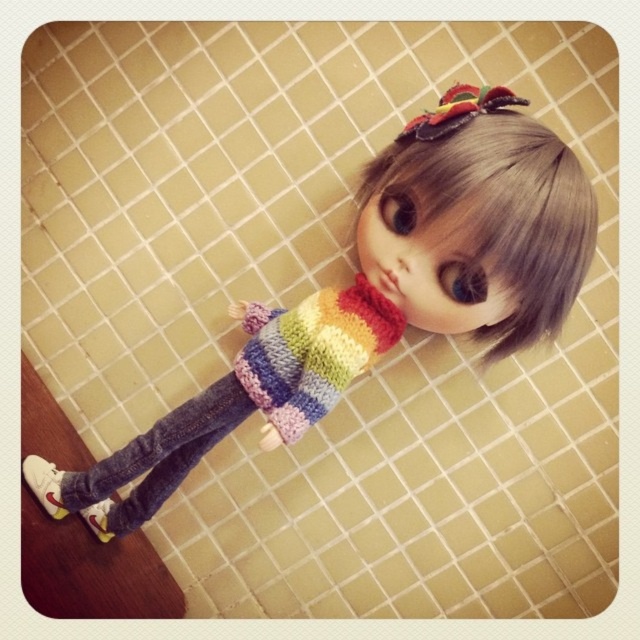
Can you confirm if knitted rainbow sweater at upper center is positioned to the left of denim jeans at lower left?

In fact, knitted rainbow sweater at upper center is to the right of denim jeans at lower left.

What do you see at coordinates (380, 294) in the screenshot? I see `knitted rainbow sweater at upper center` at bounding box center [380, 294].

You are a GUI agent. You are given a task and a screenshot of the screen. Output one action in this format:
    pyautogui.click(x=<x>, y=<y>)
    Task: Click on the knitted rainbow sweater at upper center
    This screenshot has width=640, height=640.
    Given the screenshot: What is the action you would take?
    pyautogui.click(x=380, y=294)

Between knitted rainbow sweater at upper center and blonde synthetic wig at upper center, which one is positioned lower?

knitted rainbow sweater at upper center

Describe the element at coordinates (380, 294) in the screenshot. I see `knitted rainbow sweater at upper center` at that location.

The height and width of the screenshot is (640, 640). What do you see at coordinates (380, 294) in the screenshot?
I see `knitted rainbow sweater at upper center` at bounding box center [380, 294].

You are a GUI agent. You are given a task and a screenshot of the screen. Output one action in this format:
    pyautogui.click(x=<x>, y=<y>)
    Task: Click on the knitted rainbow sweater at upper center
    The width and height of the screenshot is (640, 640).
    Given the screenshot: What is the action you would take?
    pyautogui.click(x=380, y=294)

Does blonde synthetic wig at upper center have a greater height compared to denim jeans at lower left?

Yes, blonde synthetic wig at upper center is taller than denim jeans at lower left.

Is point (564, 212) closer to viewer compared to point (115, 474)?

Yes, it is in front of point (115, 474).

At what (x,y) coordinates should I click in order to perform the action: click on blonde synthetic wig at upper center. Please return your answer as a coordinate pair (x, y). The width and height of the screenshot is (640, 640). Looking at the image, I should click on (499, 202).